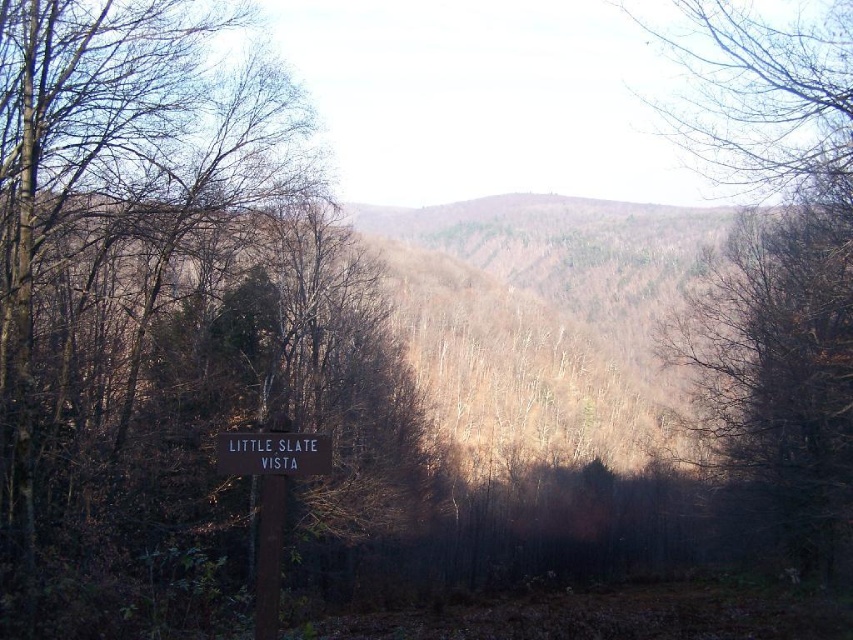
From the picture: You are standing at the center of the image and want to walk towards the brown matte tree at right. In which direction should you move?

The brown matte tree at right is located at the right side of the image, so you should move towards the right direction to reach it.

Looking at this image, you are hiking in the forest and come across two signs. The first is the brown wooden sign at lower center and the second is the black wood sign at center. Which sign is positioned to the left when facing the direction of the image?

The brown wooden sign at lower center is positioned to the left of the black wood sign at center.

You are standing in the forest and want to take a photo of the brown matte tree at right. If your camera has a maximum focus range of 12 meters, will it be able to focus on the tree?

The brown matte tree at right is 13.01 meters away from the viewer, which exceeds the camera maximum focus range of 12 meters. Therefore, the camera cannot focus on the tree.